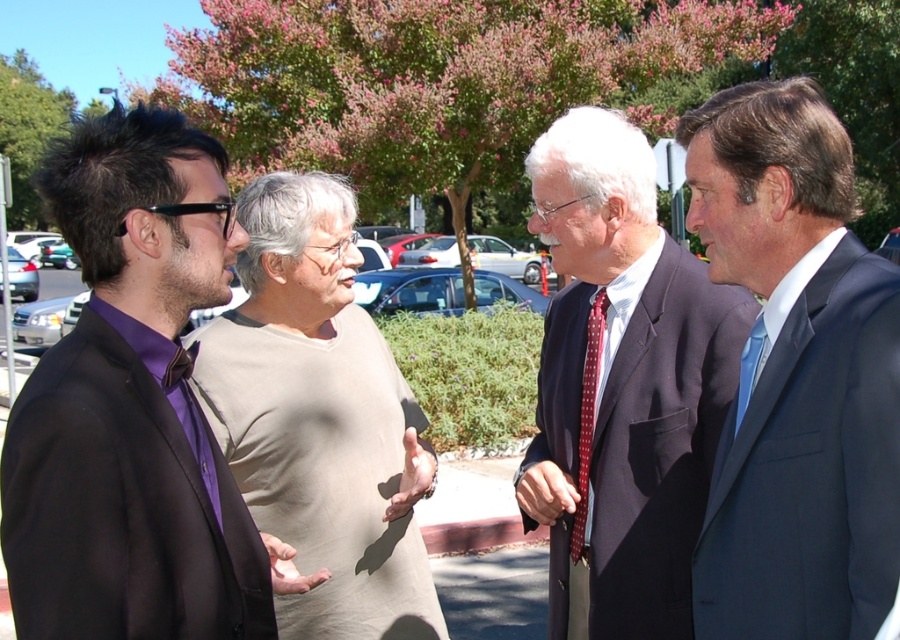
You are organizing a charity event and need to decide which outfit to recommend for a volunteer who needs to blend in with the group. The volunteer has a dark blue suit at center and a light beige cotton shirt at center available. Which outfit would make them less noticeable?

The dark blue suit at center has a smaller size compared to light beige cotton shirt at center, so the dark blue suit at center would make the volunteer less noticeable as it is smaller and might blend better with the group.

In the scene described, there are two individuals wearing a dark blue suit at center and a light beige cotton shirt at center. From the perspective of someone standing at the front of the group facing towards the parking lot, which clothing item is positioned to the right?

The dark blue suit at center is to the right of the light beige cotton shirt at center, so from the front of the group facing the parking lot, the dark blue suit at center would be on the right side.